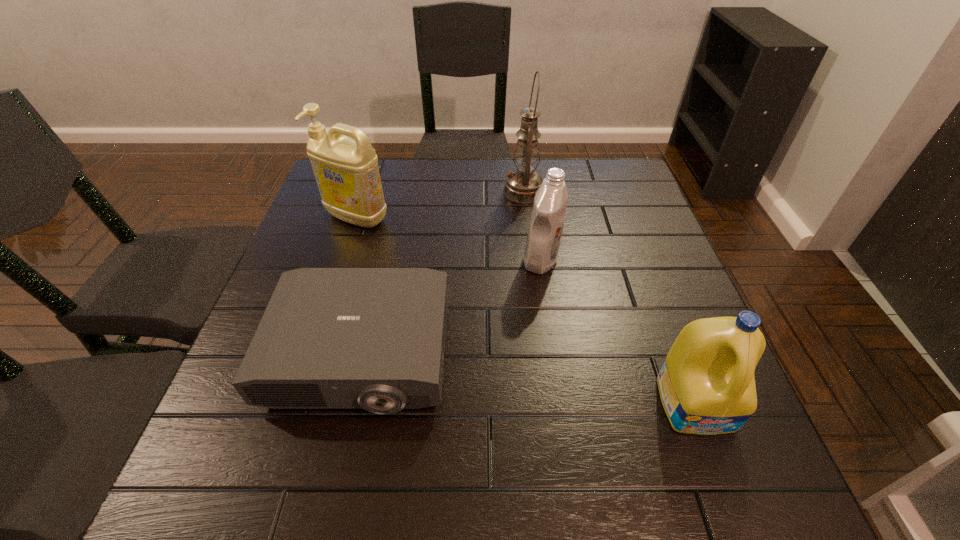
I want to click on vacant area at the near edge, so click(x=618, y=492).

Where is `vacant area at the right edge of the desktop`? The height and width of the screenshot is (540, 960). vacant area at the right edge of the desktop is located at coordinates (684, 295).

Find the location of a particular element. vacant space at the near right corner of the desktop is located at coordinates (673, 481).

In order to click on free spot between the farthest detergent and the oil lamp in this screenshot , I will do `click(441, 205)`.

Locate an element on the screen. free area in between the farthest detergent and the oil lamp is located at coordinates (441, 205).

Where is `unoccupied area between the rightmost object and the projector`? unoccupied area between the rightmost object and the projector is located at coordinates [x=528, y=379].

The width and height of the screenshot is (960, 540). Find the location of `free spot between the third farthest object and the farthest detergent`. free spot between the third farthest object and the farthest detergent is located at coordinates (449, 239).

Where is `vacant area that lies between the rightmost detergent and the farthest detergent`? The image size is (960, 540). vacant area that lies between the rightmost detergent and the farthest detergent is located at coordinates (527, 310).

Locate an element on the screen. free space that is in between the farthest detergent and the second farthest detergent is located at coordinates tap(449, 239).

I want to click on object that stands as the second closest to the second nearest detergent, so click(330, 338).